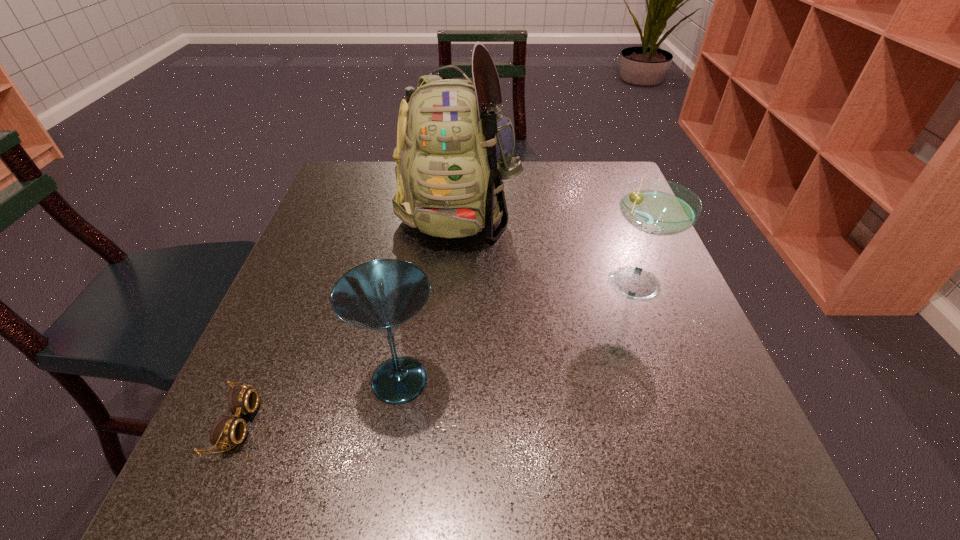
I want to click on free spot that satisfies the following two spatial constraints: 1. on the front side of the rightmost object; 2. through the lenses of the shortest object, so coord(686,424).

You are a GUI agent. You are given a task and a screenshot of the screen. Output one action in this format:
    pyautogui.click(x=<x>, y=<y>)
    Task: Click on the free point that satisfies the following two spatial constraints: 1. on the front side of the nearer martini; 2. through the lenses of the leftmost object
    
    Given the screenshot: What is the action you would take?
    pyautogui.click(x=393, y=424)

This screenshot has height=540, width=960. I want to click on vacant space that satisfies the following two spatial constraints: 1. on the front side of the right martini; 2. through the lenses of the goggles, so click(x=686, y=424).

At what (x,y) coordinates should I click in order to perform the action: click on free space that satisfies the following two spatial constraints: 1. on the front-facing side of the tallest object; 2. through the lenses of the shortest object. Please return your answer as a coordinate pair (x, y). The width and height of the screenshot is (960, 540). Looking at the image, I should click on (444, 424).

Where is `vacant space that satisfies the following two spatial constraints: 1. on the front side of the farther martini; 2. through the lenses of the shortest object`? The image size is (960, 540). vacant space that satisfies the following two spatial constraints: 1. on the front side of the farther martini; 2. through the lenses of the shortest object is located at coordinates click(686, 424).